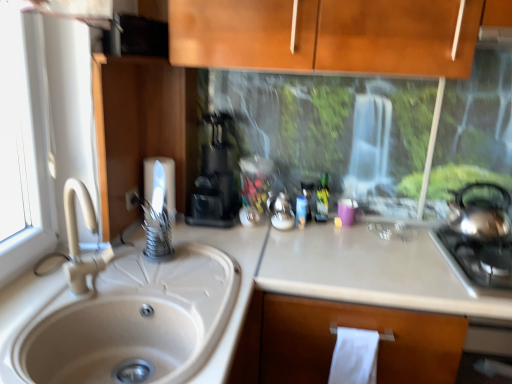
Question: Would you say white paper towel at lower center, which is counted as the second toilet paper, starting from the left, is part of green matte bottle at center's contents?

Choices:
 (A) yes
 (B) no

Answer: (B)

Question: Is the position of green matte bottle at center more distant than that of white paper towel at lower center, marked as the 2th toilet paper in a top-to-bottom arrangement?

Choices:
 (A) yes
 (B) no

Answer: (A)

Question: Does green matte bottle at center turn towards white paper towel at lower center, marked as the 2th toilet paper in a top-to-bottom arrangement?

Choices:
 (A) no
 (B) yes

Answer: (B)

Question: Considering the relative sizes of green matte bottle at center and white paper towel at lower center, which is counted as the first toilet paper, starting from the front, in the image provided, is green matte bottle at center thinner than white paper towel at lower center, which is counted as the first toilet paper, starting from the front,?

Choices:
 (A) no
 (B) yes

Answer: (B)

Question: Considering the relative sizes of green matte bottle at center and white paper towel at lower center, placed as the 1th toilet paper when sorted from bottom to top, in the image provided, is green matte bottle at center wider than white paper towel at lower center, placed as the 1th toilet paper when sorted from bottom to top,?

Choices:
 (A) yes
 (B) no

Answer: (B)

Question: From a real-world perspective, is green matte bottle at center positioned under white paper towel at lower center, marked as the 2th toilet paper in a top-to-bottom arrangement, based on gravity?

Choices:
 (A) yes
 (B) no

Answer: (B)

Question: Considering the relative positions of green matte bottle at center and stainless steel gas stove at right in the image provided, is green matte bottle at center behind stainless steel gas stove at right?

Choices:
 (A) yes
 (B) no

Answer: (A)

Question: Is green matte bottle at center outside of stainless steel gas stove at right?

Choices:
 (A) yes
 (B) no

Answer: (A)

Question: Could you tell me if green matte bottle at center is turned towards stainless steel gas stove at right?

Choices:
 (A) no
 (B) yes

Answer: (A)

Question: From a real-world perspective, is green matte bottle at center physically above stainless steel gas stove at right?

Choices:
 (A) no
 (B) yes

Answer: (B)

Question: Does green matte bottle at center contain stainless steel gas stove at right?

Choices:
 (A) no
 (B) yes

Answer: (A)

Question: Is green matte bottle at center turned away from stainless steel gas stove at right?

Choices:
 (A) yes
 (B) no

Answer: (B)

Question: From the image's perspective, would you say white matte countertop at center is shown under stainless steel gas stove at right?

Choices:
 (A) yes
 (B) no

Answer: (A)